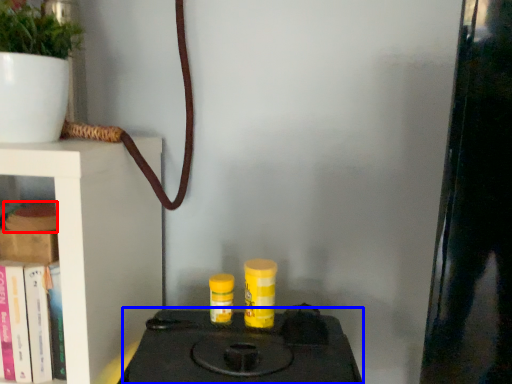
Question: Which object appears farthest to the camera in this image, book (highlighted by a red box) or stove (highlighted by a blue box)?

Choices:
 (A) book
 (B) stove

Answer: (A)